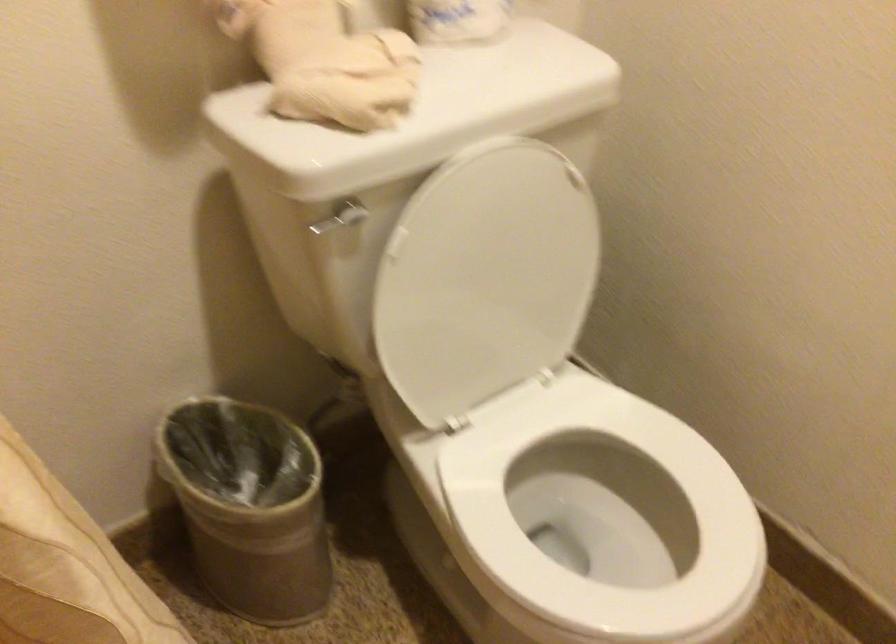
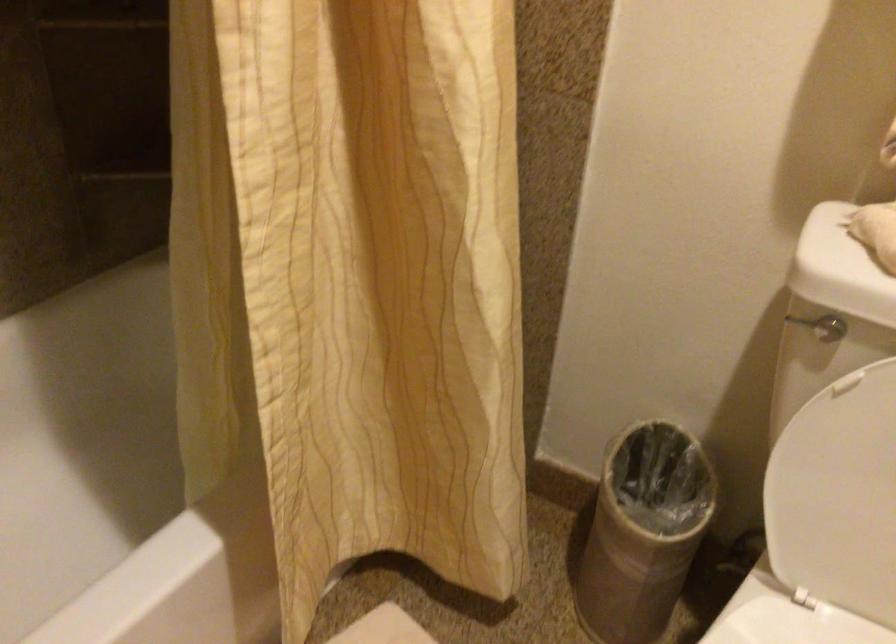
Where in the second image is the point corresponding to the point at 428,325 from the first image?

(834, 480)